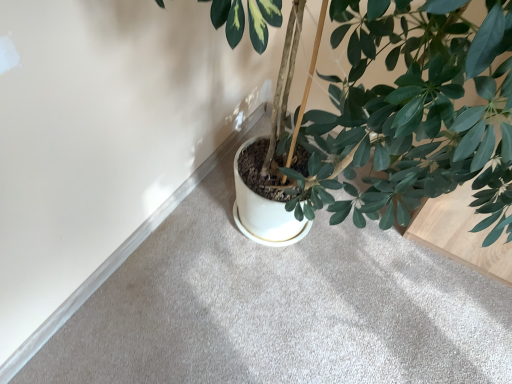
The width and height of the screenshot is (512, 384). Identify the location of white matte pot at center. (280, 309).

Describe the element at coordinates (280, 309) in the screenshot. This screenshot has height=384, width=512. I see `white matte pot at center` at that location.

Locate an element on the screen. The width and height of the screenshot is (512, 384). white matte pot at center is located at coordinates (280, 309).